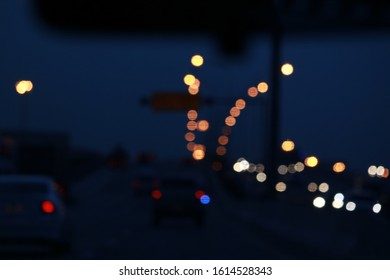
Where is `light`? The image size is (390, 280). light is located at coordinates (157, 192).